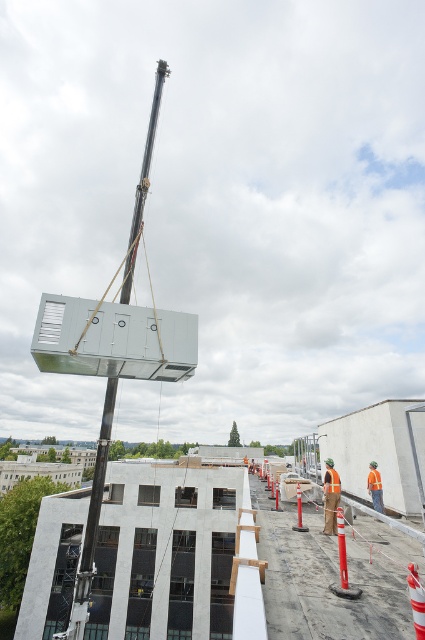
Question: Among these objects, which one is nearest to the camera?

Choices:
 (A) orange reflective safety vest at center
 (B) orange plastic traffic cone at lower right

Answer: (B)

Question: Is concrete wall at center thinner than orange plastic traffic cone at center?

Choices:
 (A) no
 (B) yes

Answer: (A)

Question: Can you confirm if orange plastic traffic cone at center is positioned to the left of orange reflective safety vest at center?

Choices:
 (A) no
 (B) yes

Answer: (B)

Question: Which is nearer to the orange reflective safety vest at center-right?

Choices:
 (A) orange reflective traffic cone at center-right
 (B) concrete wall at center

Answer: (A)

Question: Is concrete wall at center positioned before orange plastic traffic cone at center?

Choices:
 (A) yes
 (B) no

Answer: (A)

Question: Which object appears farthest from the camera in this image?

Choices:
 (A) orange reflective safety vest at center-right
 (B) orange plastic traffic cone at center
 (C) orange reflective traffic cone at center-right
 (D) concrete wall at center

Answer: (C)